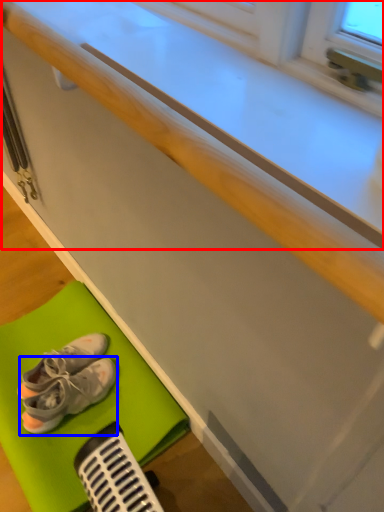
Question: Among these objects, which one is nearest to the camera, counter top (highlighted by a red box) or footwear (highlighted by a blue box)?

Choices:
 (A) counter top
 (B) footwear

Answer: (A)